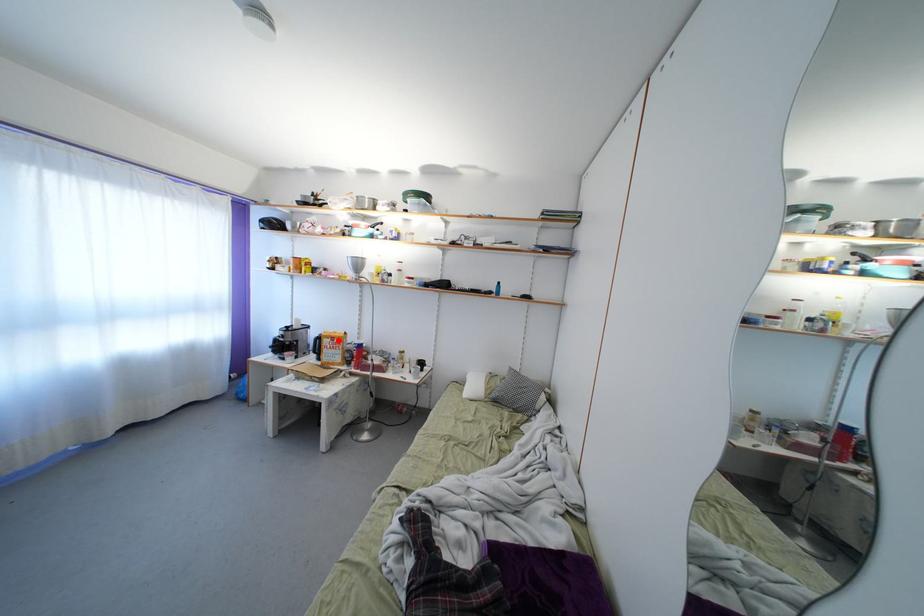
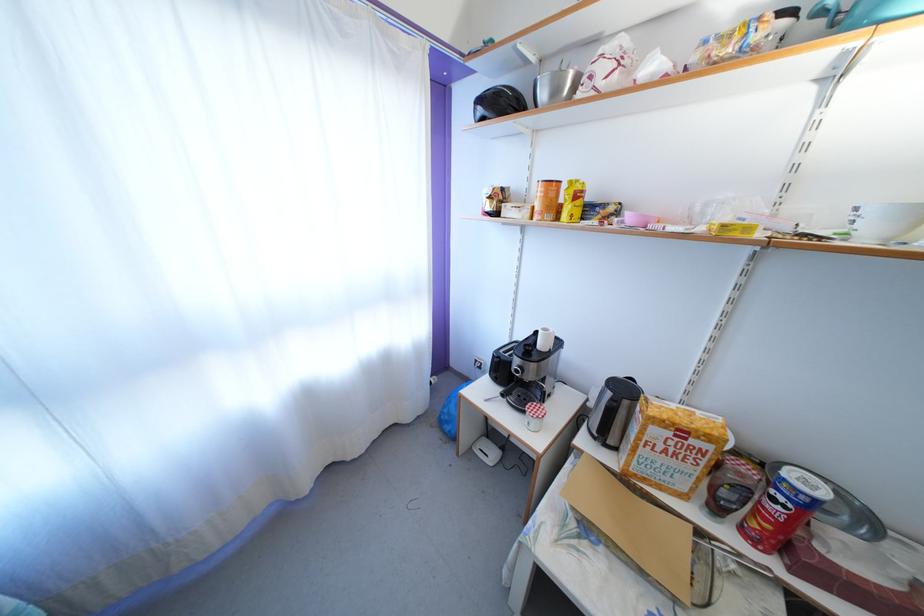
In the second image, find the point that corresponds to the highlighted location in the first image.

(688, 428)